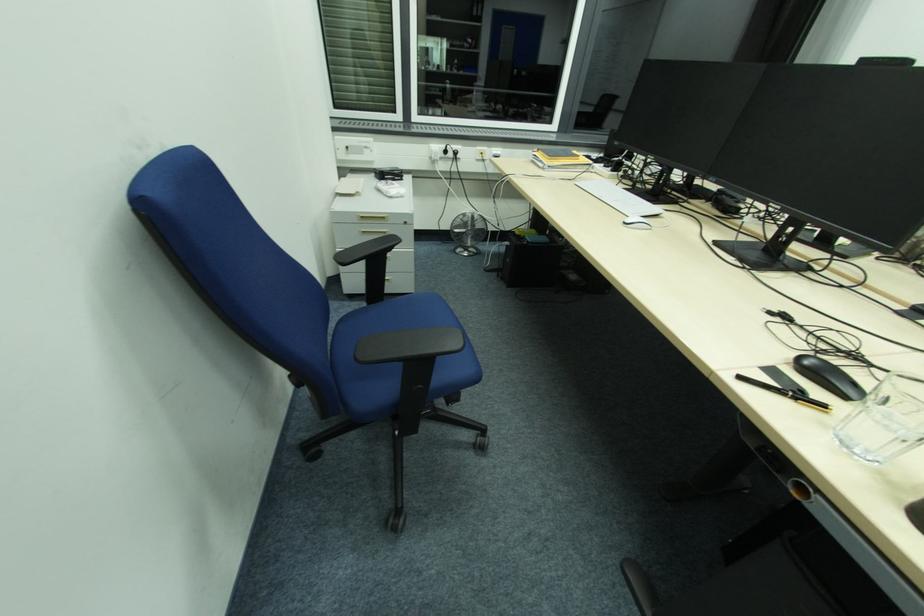
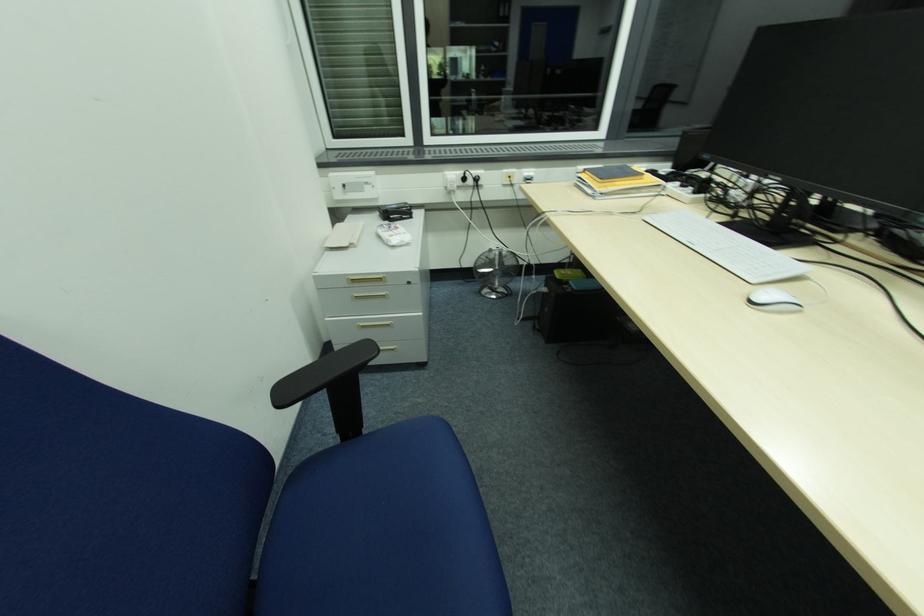
Question: In a continuous first-person perspective shot, in which direction is the camera moving?

Choices:
 (A) Left
 (B) Right
 (C) Forward
 (D) Backward

Answer: (C)